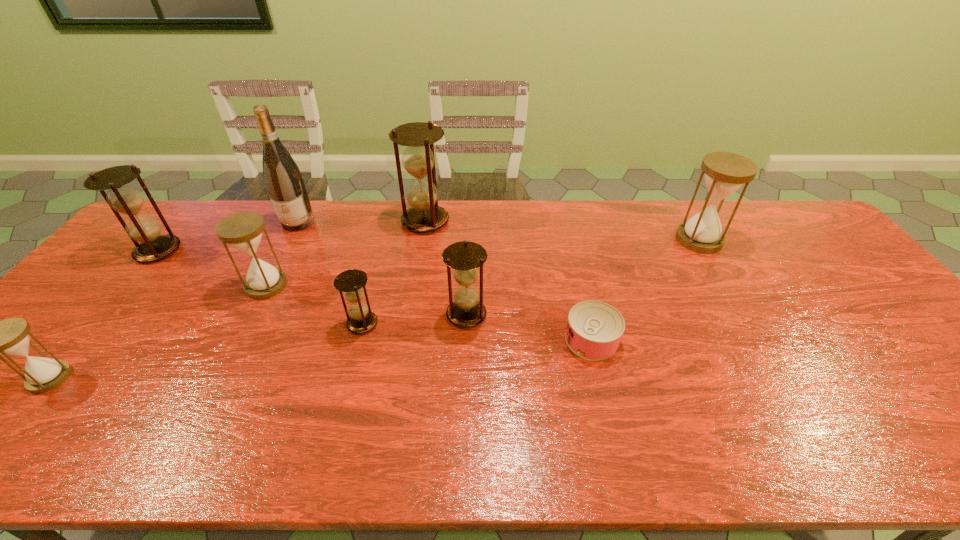
You are a GUI agent. You are given a task and a screenshot of the screen. Output one action in this format:
    pyautogui.click(x=<x>, y=<y>)
    Task: Click on the tallest object
    
    Given the screenshot: What is the action you would take?
    pyautogui.click(x=284, y=182)

Locate an element on the screen. This screenshot has width=960, height=540. brown wine bottle is located at coordinates (284, 182).

This screenshot has width=960, height=540. I want to click on the fifth hourglass from left to right, so click(x=425, y=215).

What are the coordinates of `the tallest hourglass` in the screenshot? It's located at pos(425,215).

The image size is (960, 540). What are the coordinates of `the third smallest brown hourglass` in the screenshot? It's located at (122, 198).

Locate an element on the screen. This screenshot has width=960, height=540. the second farthest brown hourglass is located at coordinates (122, 198).

This screenshot has height=540, width=960. Identify the location of the farthest white hourglass. (725, 172).

Where is `the rightmost white hourglass`? the rightmost white hourglass is located at coordinates (725, 172).

Where is `the second farthest white hourglass`? Image resolution: width=960 pixels, height=540 pixels. the second farthest white hourglass is located at coordinates (243, 230).

You are a GUI agent. You are given a task and a screenshot of the screen. Output one action in this format:
    pyautogui.click(x=<x>, y=<y>)
    Task: Click on the second biggest white hourglass
    
    Given the screenshot: What is the action you would take?
    click(x=243, y=230)